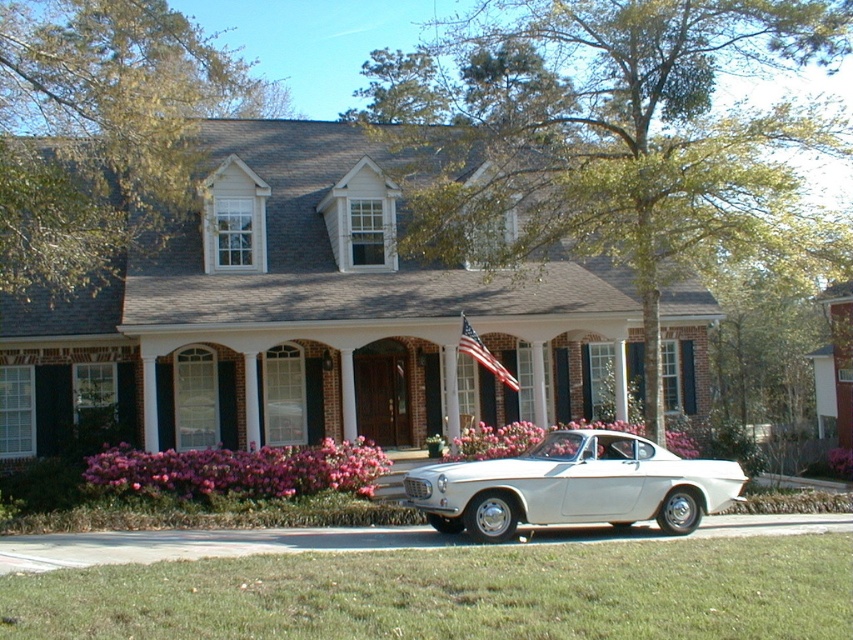
Question: Which object is closer to the camera taking this photo?

Choices:
 (A) white glossy car at center
 (B) pink matte flowers at center
 (C) american flag at center

Answer: (A)

Question: Which of the following is the farthest from the observer?

Choices:
 (A) white glossy car at center
 (B) american flag at center

Answer: (B)

Question: Observing the image, what is the correct spatial positioning of pink matte flowers at lower center in reference to american flag at center?

Choices:
 (A) below
 (B) above

Answer: (A)

Question: Is white glossy car at center above american flag at center?

Choices:
 (A) no
 (B) yes

Answer: (A)

Question: Is the position of white glossy car at center less distant than that of pink matte flowers at center?

Choices:
 (A) yes
 (B) no

Answer: (A)

Question: Which is farther from the pink matte flowers at center?

Choices:
 (A) american flag at center
 (B) white glossy car at center
 (C) pink matte flowers at lower center

Answer: (B)